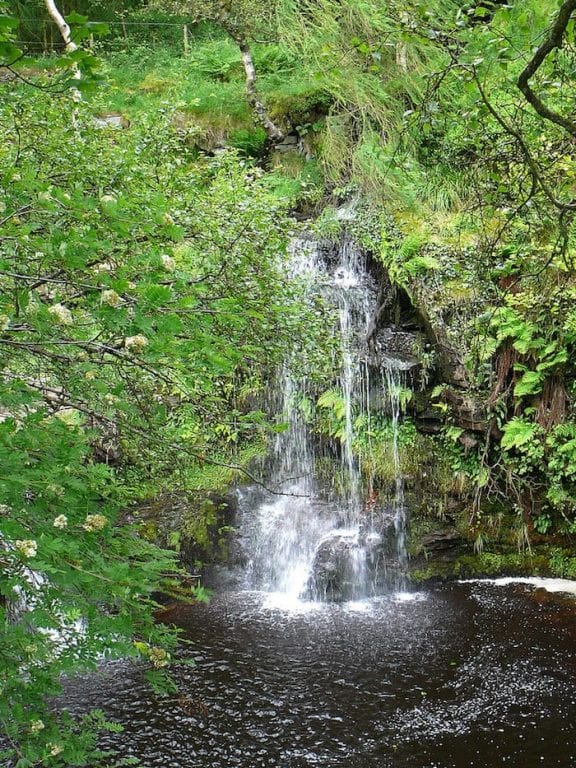
Where is `foam`? foam is located at coordinates (503, 565).